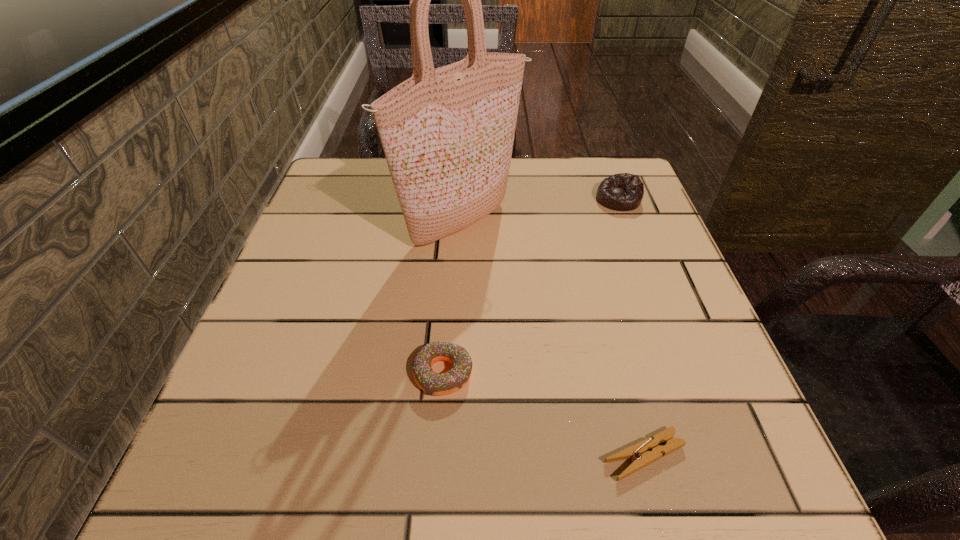
This screenshot has width=960, height=540. In the image, there is a desktop. Identify the location of free region at the near left corner. (219, 491).

This screenshot has width=960, height=540. I want to click on free space at the far right corner of the desktop, so click(x=593, y=194).

This screenshot has width=960, height=540. In order to click on vacant point located between the nearest object and the third shortest object in this screenshot , I will do `click(631, 327)`.

Find the location of a particular element. The image size is (960, 540). free point between the beanbag and the shopping bag is located at coordinates (540, 211).

I want to click on vacant space that is in between the tallest object and the nearest object, so click(x=553, y=339).

You are a GUI agent. You are given a task and a screenshot of the screen. Output one action in this format:
    pyautogui.click(x=<x>, y=<y>)
    Task: Click on the vacant area that lies between the shopping bag and the clothespin
    The image size is (960, 540).
    Given the screenshot: What is the action you would take?
    pyautogui.click(x=553, y=339)

Image resolution: width=960 pixels, height=540 pixels. Identify the location of free space between the clothespin and the shopping bag. (553, 339).

Where is `free space between the tallest object and the nearest object`? free space between the tallest object and the nearest object is located at coordinates pyautogui.click(x=553, y=339).

The image size is (960, 540). Identify the location of empty space that is in between the clothespin and the doughnut. (543, 414).

The height and width of the screenshot is (540, 960). I want to click on vacant area that lies between the second nearest object and the tallest object, so pyautogui.click(x=452, y=298).